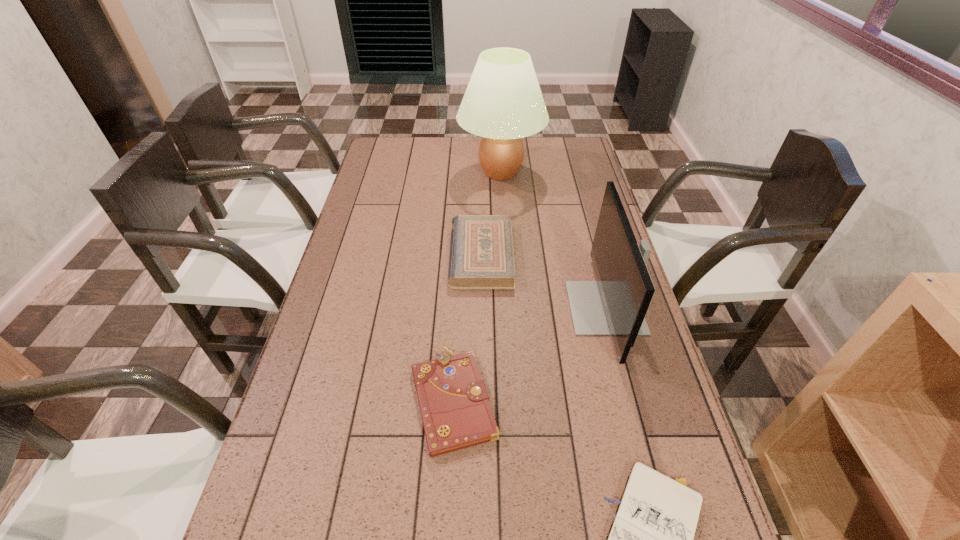
Identify the location of the farthest object. (503, 103).

Locate an element on the screen. lampshade is located at coordinates (503, 103).

Image resolution: width=960 pixels, height=540 pixels. I want to click on the second tallest object, so click(x=616, y=304).

Locate an element on the screen. This screenshot has height=540, width=960. the third shortest object is located at coordinates (481, 256).

You are a GUI agent. You are given a task and a screenshot of the screen. Output one action in this format:
    pyautogui.click(x=<x>, y=<y>)
    Task: Click on the left notebook
    
    Given the screenshot: What is the action you would take?
    pyautogui.click(x=456, y=413)

What are the coordinates of `the fourth tallest object` in the screenshot? It's located at (456, 413).

I want to click on vacant space positioned on the shade of the lampshade, so click(x=441, y=172).

I want to click on vacant area located 0.150m on the shade of the lampshade, so click(x=420, y=172).

Where is `free spot located on the shade of the lampshade`? This screenshot has height=540, width=960. free spot located on the shade of the lampshade is located at coordinates (420, 172).

The image size is (960, 540). I want to click on free space located on the screen of the second tallest object, so click(x=444, y=308).